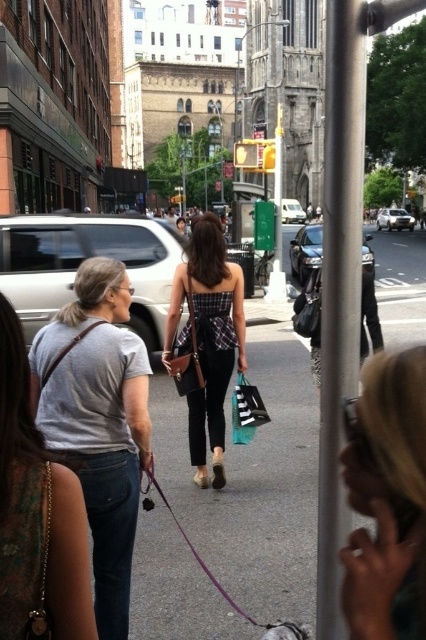
Question: Can you confirm if plaid fabric dress at center is positioned above black matte shopping bag at center?

Choices:
 (A) yes
 (B) no

Answer: (A)

Question: Which of the following is the closest to the observer?

Choices:
 (A) (126, 628)
 (B) (222, 365)
 (C) (325, 38)
 (D) (408, 572)

Answer: (D)

Question: Does metallic gray pole at center come in front of plaid fabric dress at center?

Choices:
 (A) no
 (B) yes

Answer: (B)

Question: Which point is closer to the camera taking this photo?

Choices:
 (A) (244, 408)
 (B) (345, 509)
 (C) (221, 260)

Answer: (B)

Question: Does blonde hair at upper right lie behind black matte shopping bag at center?

Choices:
 (A) no
 (B) yes

Answer: (A)

Question: Which point appears closest to the camera in this image?

Choices:
 (A) (65, 572)
 (B) (213, 481)
 (C) (293, 634)
 (D) (423, 554)

Answer: (D)